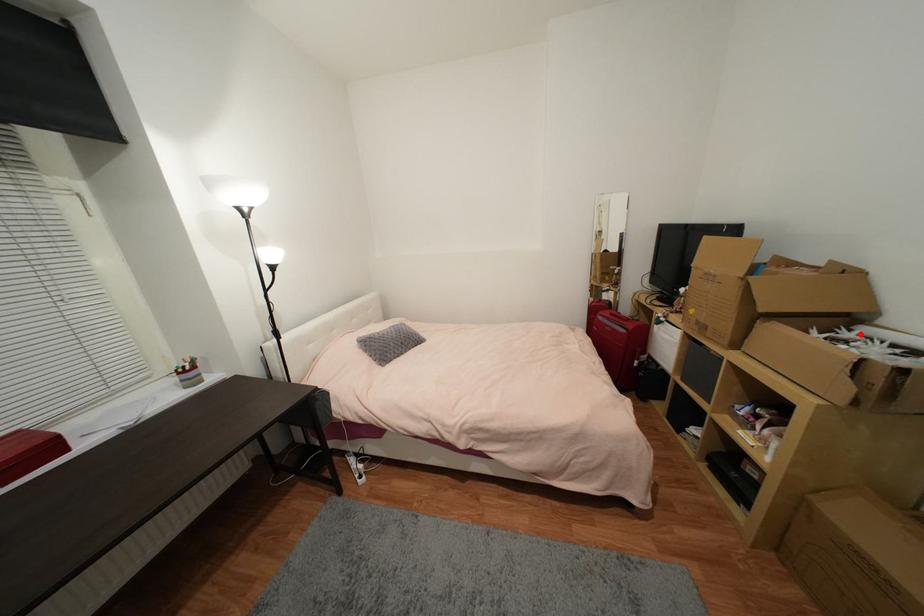
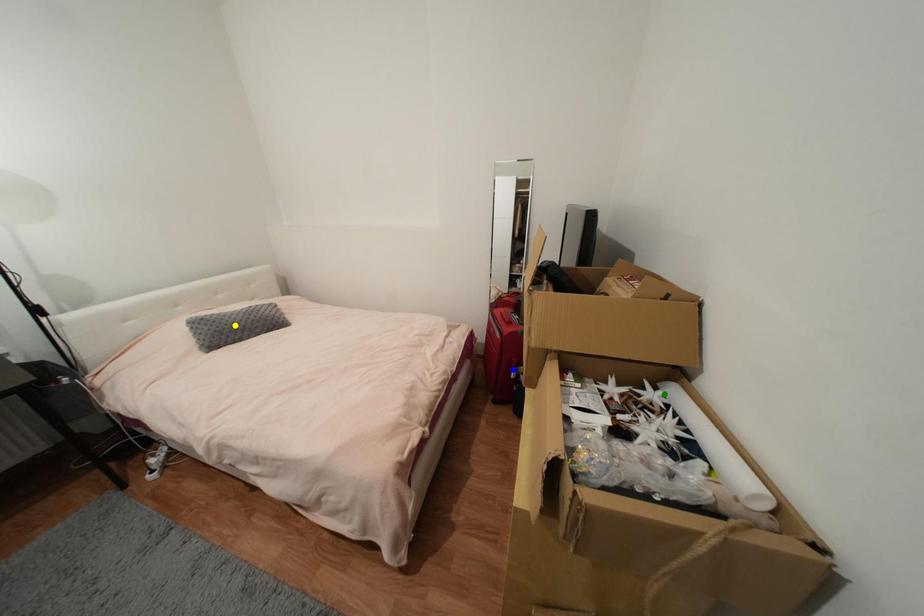
Question: I am providing you with two images of the same scene from different viewpoints. A red point is marked on the first image. You are given multiple points on the second image. Which mark in image 2 goes with the point in image 1?

Choices:
 (A) yellow point
 (B) blue point
 (C) green point

Answer: (C)